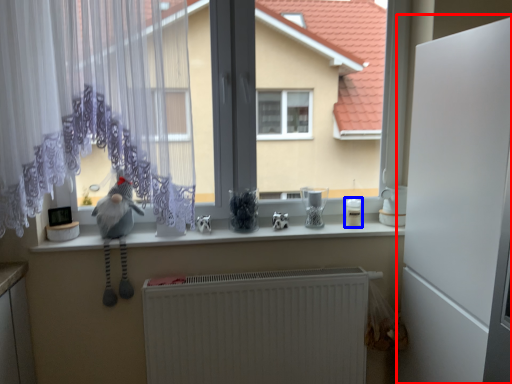
Question: Which of the following is the closest to the observer, screen door (highlighted by a red box) or appliance (highlighted by a blue box)?

Choices:
 (A) screen door
 (B) appliance

Answer: (A)